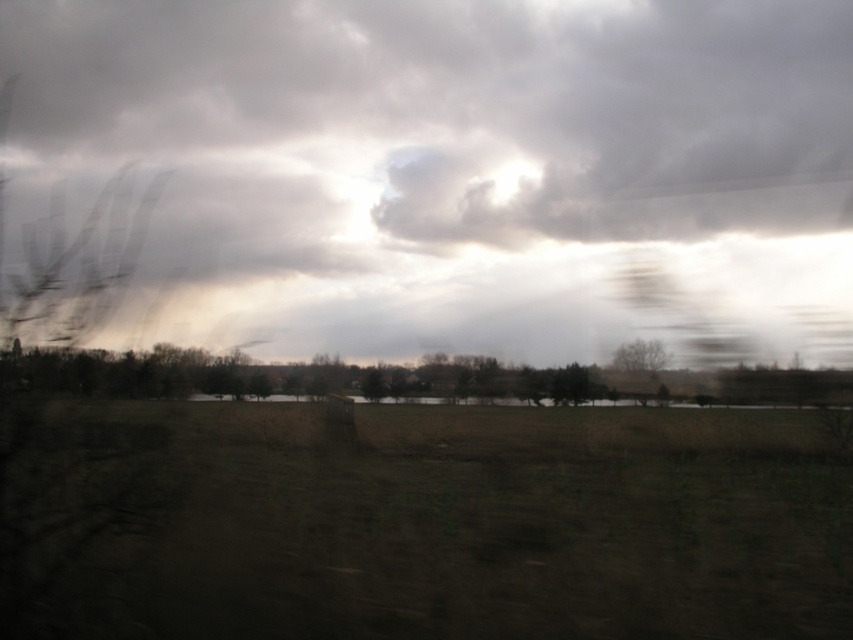
You are sitting in a moving car and notice two points through the window. The first point is at coordinates point (381, 308) and the second is at point (619, 365). Based on the scene, which point is closer to you?

Point (619, 365) is closer because it is in front of point (381, 308) according to the description.

You are a passenger in a moving car and notice the cloudy textured sky at center and the green matte tree at center through the window. Which object appears taller in the scene?

The cloudy textured sky at center is taller than the green matte tree at center.